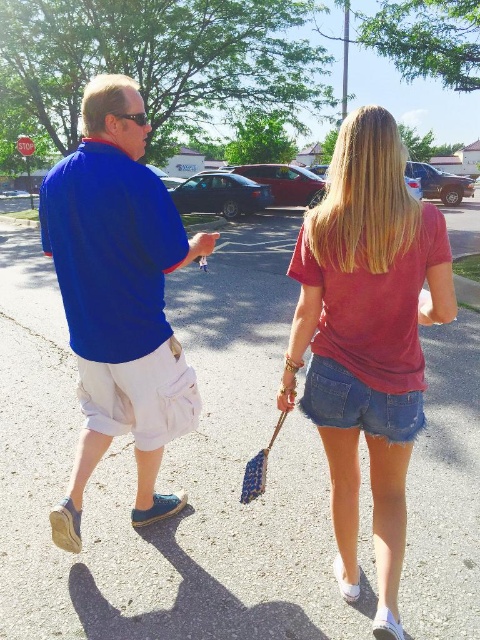
Question: Which point appears closest to the camera in this image?

Choices:
 (A) (372, 243)
 (B) (84, 349)

Answer: (A)

Question: Can you confirm if denim shorts at center is positioned above blue cotton shirt at left?

Choices:
 (A) yes
 (B) no

Answer: (B)

Question: Does denim shorts at center appear over blue cotton shirt at left?

Choices:
 (A) yes
 (B) no

Answer: (B)

Question: Can you confirm if denim shorts at center is positioned to the left of blue cotton shirt at left?

Choices:
 (A) no
 (B) yes

Answer: (A)